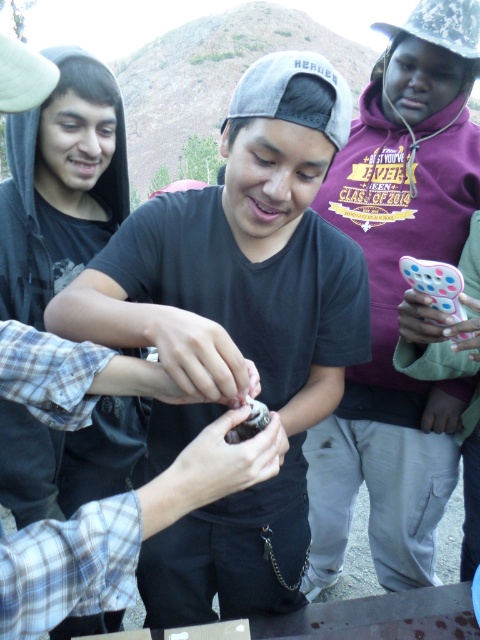
Question: Which of the following is the farthest from the observer?

Choices:
 (A) spongy white bread at center
 (B) black matte shirt at center
 (C) matte black phone at center

Answer: (C)

Question: Which point appears closest to the camera in this image?

Choices:
 (A) (299, 442)
 (B) (265, 424)
 (C) (411, 573)

Answer: (B)

Question: Can you confirm if black matte shirt at center is wider than spongy white bread at center?

Choices:
 (A) yes
 (B) no

Answer: (A)

Question: Is black matte shirt at center closer to the viewer compared to matte black phone at center?

Choices:
 (A) no
 (B) yes

Answer: (B)

Question: Which object is the closest to the spongy white bread at center?

Choices:
 (A) matte black phone at center
 (B) black matte shirt at center

Answer: (B)

Question: Can you confirm if black matte shirt at center is wider than matte black phone at center?

Choices:
 (A) yes
 (B) no

Answer: (A)